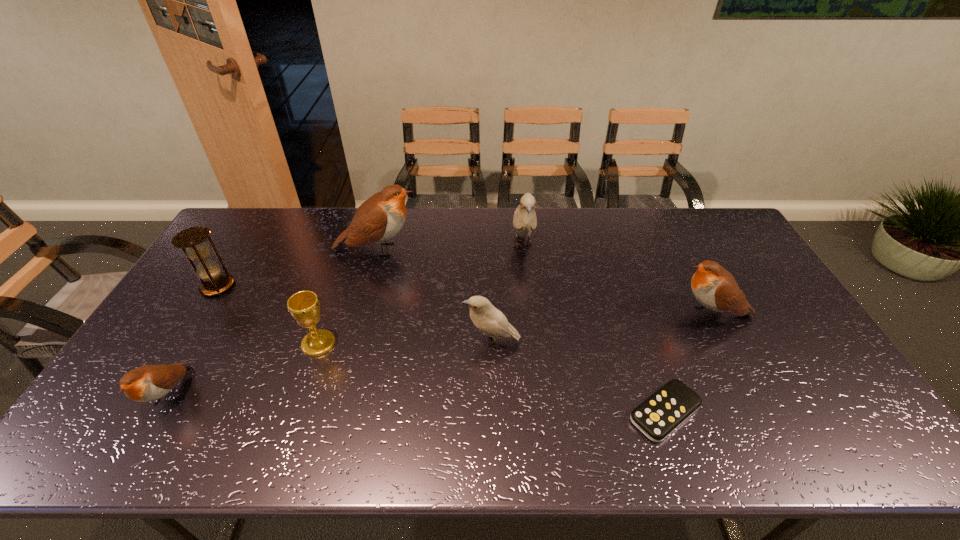
The width and height of the screenshot is (960, 540). I want to click on the second brown bird from right to left, so click(x=378, y=219).

The image size is (960, 540). I want to click on the second bird from left to right, so click(x=378, y=219).

Where is `the farther white bird`? Image resolution: width=960 pixels, height=540 pixels. the farther white bird is located at coordinates (524, 220).

The image size is (960, 540). I want to click on hourglass, so click(208, 271).

Identify the location of the rightmost brown bird. (715, 288).

I want to click on the second biggest brown bird, so click(x=715, y=288).

Find the location of a particular element. the nearer white bird is located at coordinates (492, 322).

Find the location of a particular element. the smaller white bird is located at coordinates (492, 322).

Identify the location of gold chalice. The width and height of the screenshot is (960, 540). (304, 306).

Locate an element on the screen. Image resolution: width=960 pixels, height=540 pixels. the leftmost brown bird is located at coordinates (147, 383).